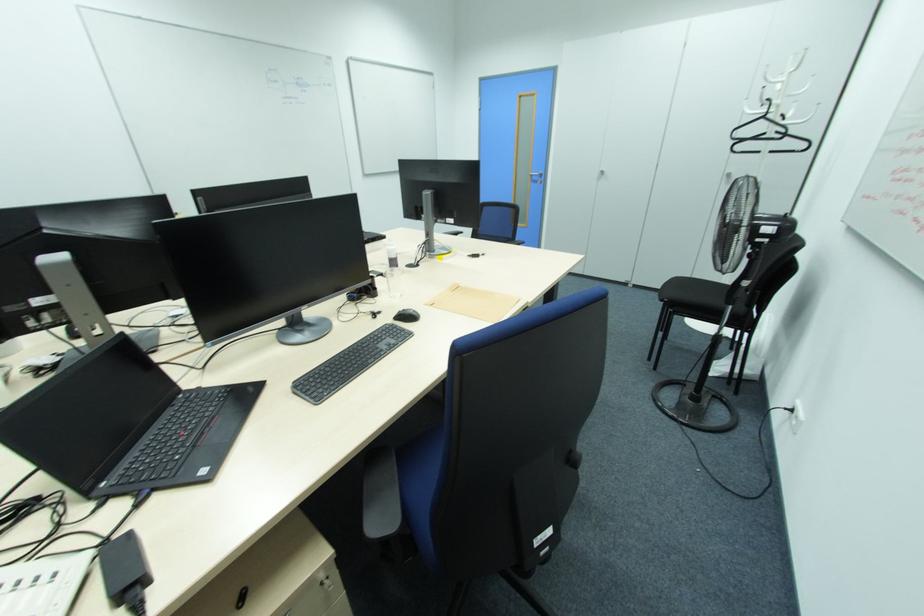
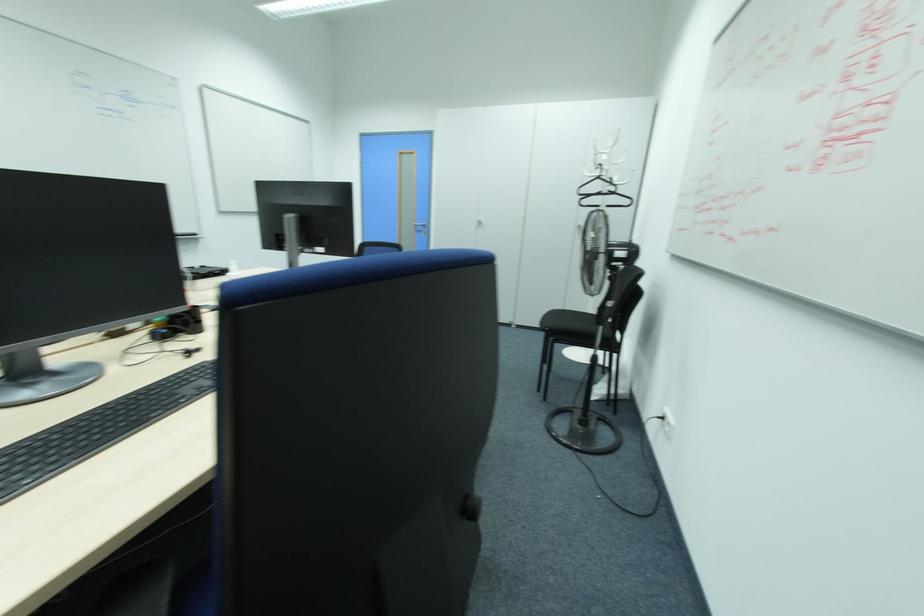
Locate, in the second image, the point that corresponds to (x=764, y=118) in the first image.

(599, 177)